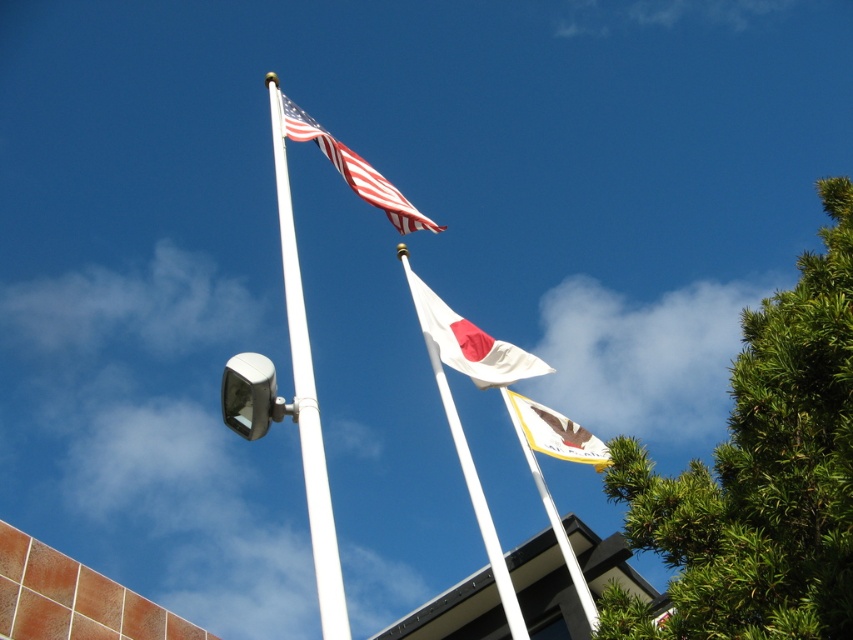
You are a pedestrian standing at the crosswalk. You see a green leafy tree at right and a satin silver traffic light at upper center. How far apart are these two objects?

The green leafy tree at right is 15.15 feet from the satin silver traffic light at upper center.

You are standing in front of the three flagpoles and want to take a photo. You notice two points marked as point 1 and point 2. Point 1 is at coordinate point (554, 504) and point 2 is at coordinate point (566, 422). Which point is closer to your camera lens?

Point 1 at coordinate point (554, 504) is closer to the camera lens than point 2 at coordinate point (566, 422) because it is further to the camera according to the description.

You are driving a car and see the green leafy tree at right and the satin silver traffic light at upper center. Which object is nearer to you?

The green leafy tree at right is closer to the viewer than the satin silver traffic light at upper center.